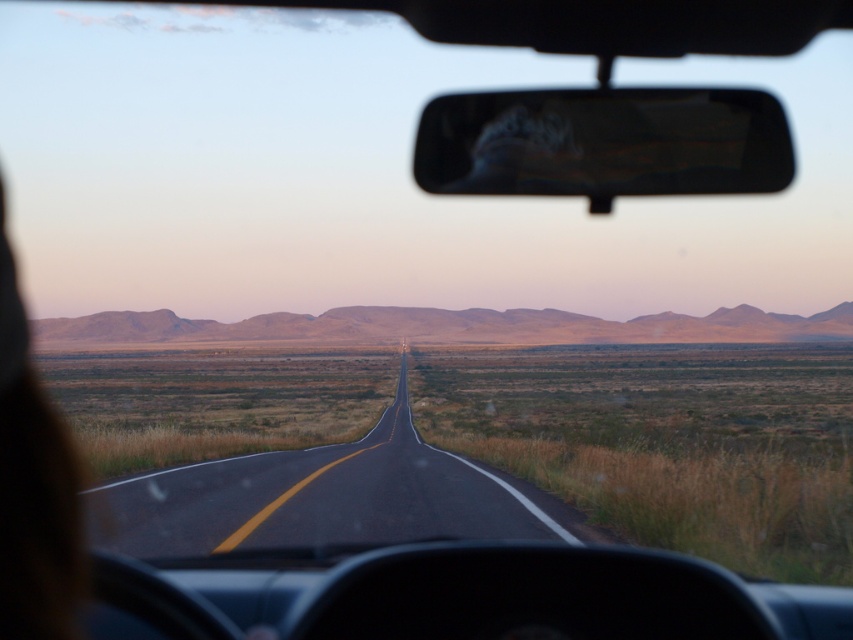
Is asphalt road at center taller than black glossy view mirror at upper center?

Correct, asphalt road at center is much taller as black glossy view mirror at upper center.

Does asphalt road at center come in front of black glossy view mirror at upper center?

No, asphalt road at center is behind black glossy view mirror at upper center.

Who is more forward, (289, 460) or (715, 164)?

Point (715, 164) is in front.

Locate an element on the screen. The image size is (853, 640). asphalt road at center is located at coordinates 323,499.